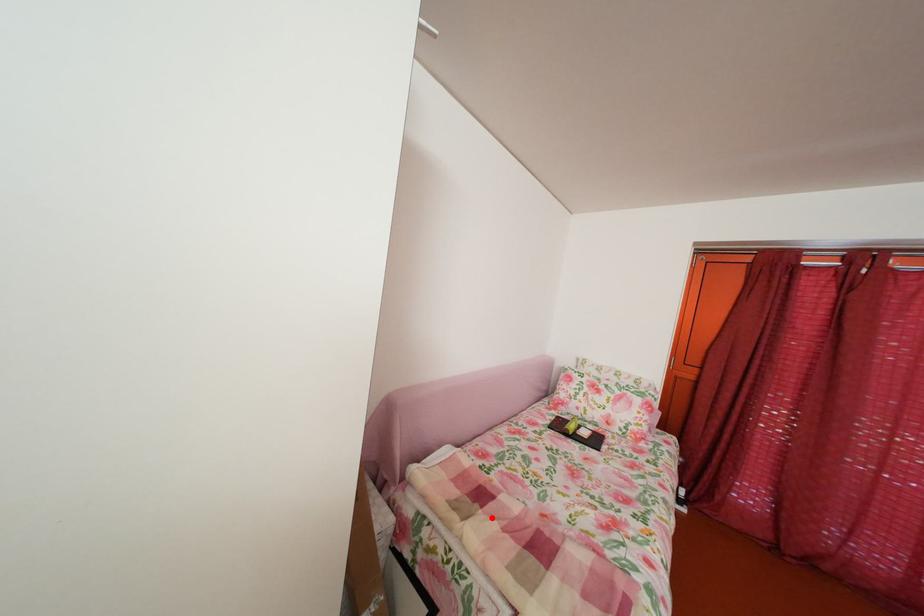
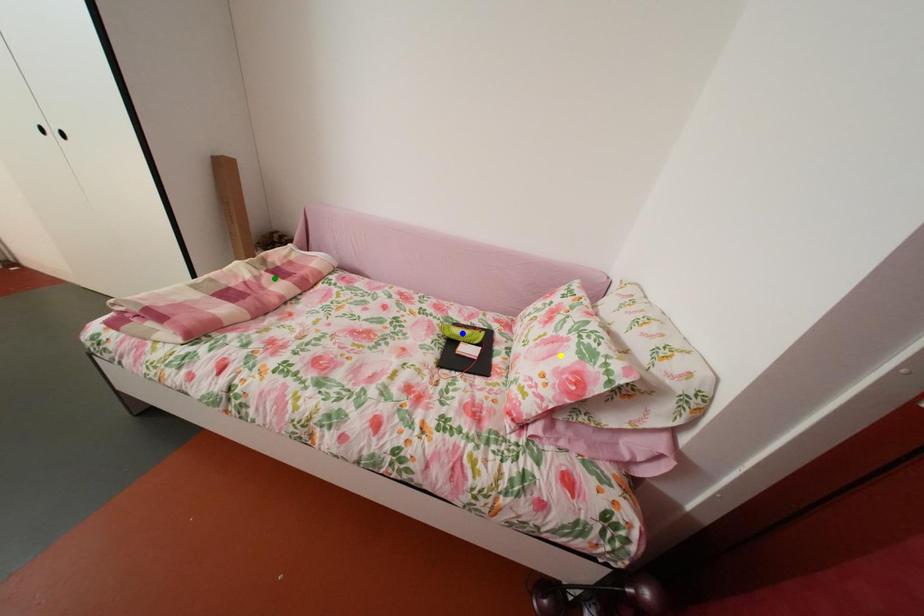
Question: I am providing you with two images of the same scene from different viewpoints. A red point is marked on the first image. You are given multiple points on the second image. Which mark in image 2 goes with the point in image 1?

Choices:
 (A) green point
 (B) blue point
 (C) yellow point

Answer: (A)